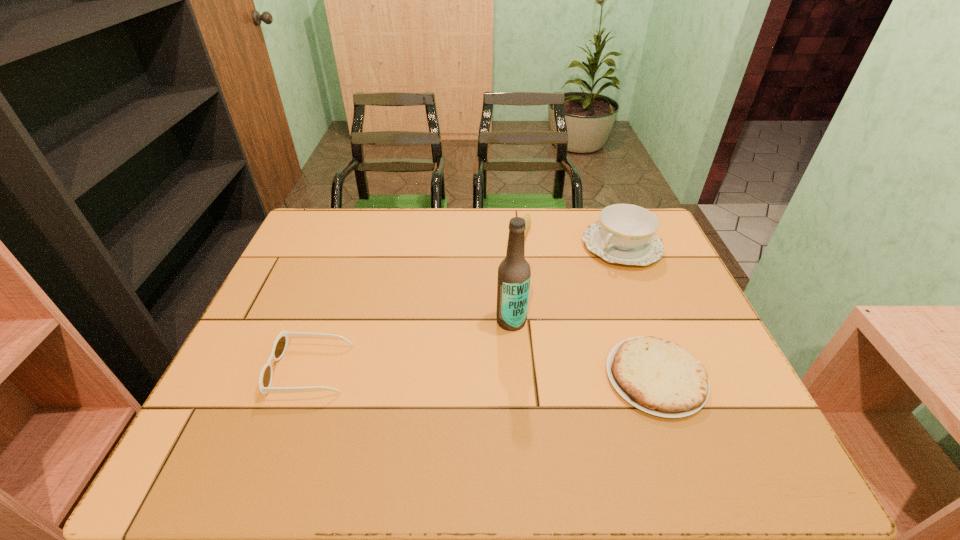
Find the location of a particular element. The width and height of the screenshot is (960, 540). vacant space on the desktop that is between the second shortest object and the shortest object and is positioned at the stem of the banana is located at coordinates (460, 373).

Where is `vacant spot on the desktop that is between the second shortest object and the tortilla and is positioned on the side of the beer bottle with the label`? This screenshot has width=960, height=540. vacant spot on the desktop that is between the second shortest object and the tortilla and is positioned on the side of the beer bottle with the label is located at coordinates (451, 373).

Where is `free space on the desktop that is between the leftmost object and the tortilla and is positioned on the handle side of the chinaware`? This screenshot has height=540, width=960. free space on the desktop that is between the leftmost object and the tortilla and is positioned on the handle side of the chinaware is located at coordinates (462, 373).